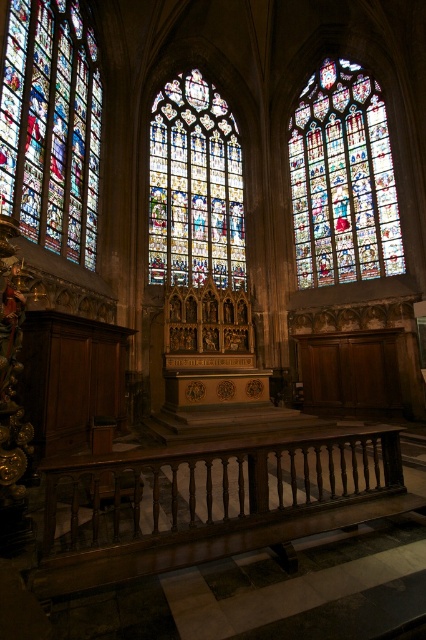
Which of these two, stained glass window at left or stained glass window at center, stands shorter?

stained glass window at left is shorter.

Does stained glass window at left have a greater height compared to stained glass window at center?

Incorrect, stained glass window at left's height is not larger of stained glass window at center's.

Between point (28, 221) and point (175, 160), which one is positioned behind?

The point (175, 160) is more distant.

You are a GUI agent. You are given a task and a screenshot of the screen. Output one action in this format:
    pyautogui.click(x=<x>, y=<y>)
    Task: Click on the stained glass window at left
    This screenshot has width=426, height=640.
    Given the screenshot: What is the action you would take?
    pyautogui.click(x=51, y=125)

Is stained glass window at left wider than stained glass window at upper right?

In fact, stained glass window at left might be narrower than stained glass window at upper right.

Locate an element on the screen. The width and height of the screenshot is (426, 640). stained glass window at left is located at coordinates (51, 125).

At what (x,y) coordinates should I click in order to perform the action: click on stained glass window at left. Please return your answer as a coordinate pair (x, y). Looking at the image, I should click on (51, 125).

At what (x,y) coordinates should I click in order to perform the action: click on stained glass window at left. Please return your answer as a coordinate pair (x, y). Looking at the image, I should click on (51, 125).

Can you confirm if dark brown polished wood balustrade at lower center is positioned to the left of stained glass window at upper right?

Correct, you'll find dark brown polished wood balustrade at lower center to the left of stained glass window at upper right.

Is dark brown polished wood balustrade at lower center thinner than stained glass window at upper right?

In fact, dark brown polished wood balustrade at lower center might be wider than stained glass window at upper right.

Locate an element on the screen. dark brown polished wood balustrade at lower center is located at coordinates (209, 502).